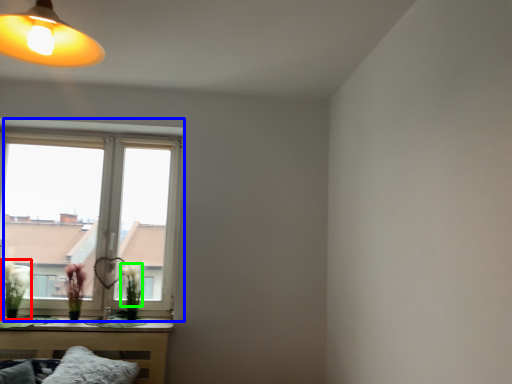
Question: Based on their relative distances, which object is farther from floral arrangement (highlighted by a red box)? Choose from window (highlighted by a blue box) and flower (highlighted by a green box).

Choices:
 (A) window
 (B) flower

Answer: (B)